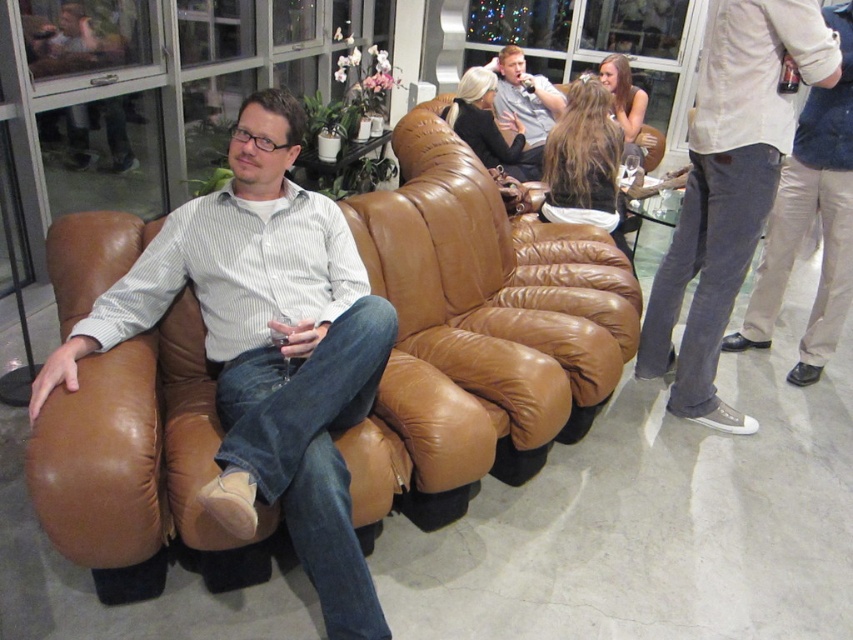
Which is more to the right, matte brown leather couch at left or matte gray shirt at upper center?

matte gray shirt at upper center

Which of these two, matte brown leather couch at left or matte gray shirt at upper center, stands taller?

With more height is matte brown leather couch at left.

Is point (334, 312) positioned in front of point (498, 51)?

Yes, point (334, 312) is closer to viewer.

Image resolution: width=853 pixels, height=640 pixels. I want to click on matte brown leather couch at left, so click(265, 348).

Is light gray jeans at right positioned before matte gray shirt at upper center?

Result: That is True.

Can you confirm if light gray jeans at right is taller than matte gray shirt at upper center?

Correct, light gray jeans at right is much taller as matte gray shirt at upper center.

Does point (824, 70) lie in front of point (555, 115)?

Yes.

I want to click on light gray jeans at right, so click(728, 188).

Can you confirm if light gray jeans at right is thinner than light beige pants at right?

Yes.

Is light gray jeans at right behind light beige pants at right?

No.

Is point (717, 397) positioned behind point (845, 97)?

That is True.

The height and width of the screenshot is (640, 853). What are the coordinates of `light gray jeans at right` in the screenshot? It's located at (728, 188).